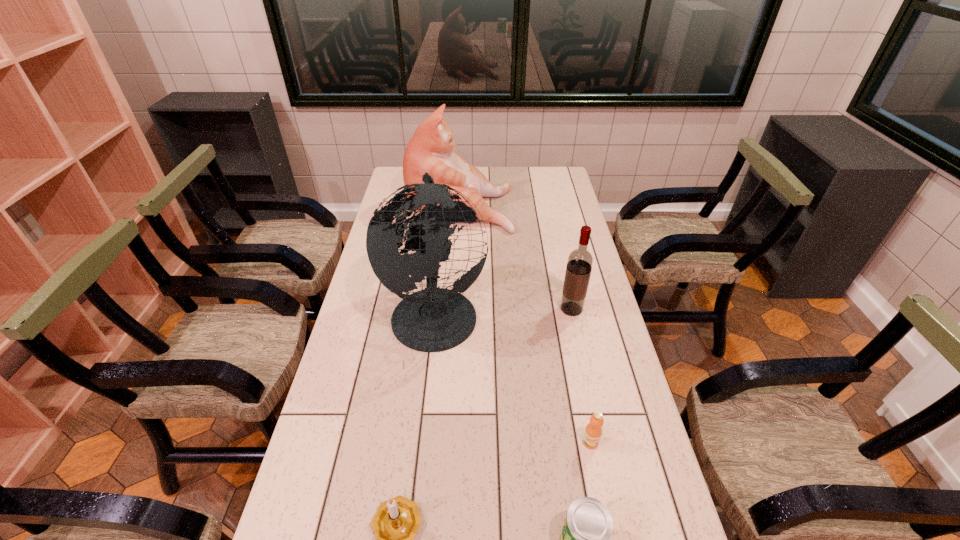
Image resolution: width=960 pixels, height=540 pixels. In order to click on globe in this screenshot , I will do `click(434, 319)`.

You are a GUI agent. You are given a task and a screenshot of the screen. Output one action in this format:
    pyautogui.click(x=<x>, y=<y>)
    Task: Click on the farthest object
    The height and width of the screenshot is (540, 960).
    Given the screenshot: What is the action you would take?
    pyautogui.click(x=431, y=149)

This screenshot has width=960, height=540. What are the coordinates of `wine bottle` in the screenshot? It's located at (579, 264).

Where is `orange juice`? Image resolution: width=960 pixels, height=540 pixels. orange juice is located at coordinates (593, 431).

I want to click on blank area located 0.200m on the front-facing side of the globe, so click(x=549, y=311).

At what (x,y) coordinates should I click in order to perform the action: click on vacant space located 0.140m on the face of the farthest object. Please return your answer as a coordinate pair (x, y). This screenshot has width=960, height=540. Looking at the image, I should click on (545, 205).

Find the location of `vacant space located on the back of the third tallest object`. vacant space located on the back of the third tallest object is located at coordinates (567, 289).

Locate an element on the screen. vacant space located on the front label of the orange juice is located at coordinates (596, 470).

You are a GUI agent. You are given a task and a screenshot of the screen. Output one action in this format:
    pyautogui.click(x=<x>, y=<y>)
    Task: Click on the object situated at the far edge
    The height and width of the screenshot is (540, 960).
    Given the screenshot: What is the action you would take?
    pyautogui.click(x=431, y=149)

The height and width of the screenshot is (540, 960). Identify the location of globe that is at the left edge. (434, 319).